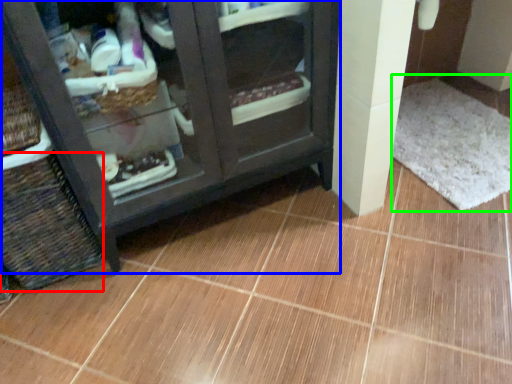
Question: Which object is the farthest from basket (highlighted by a red box)? Choose among these: furniture (highlighted by a blue box) or bath mat (highlighted by a green box).

Choices:
 (A) furniture
 (B) bath mat

Answer: (B)